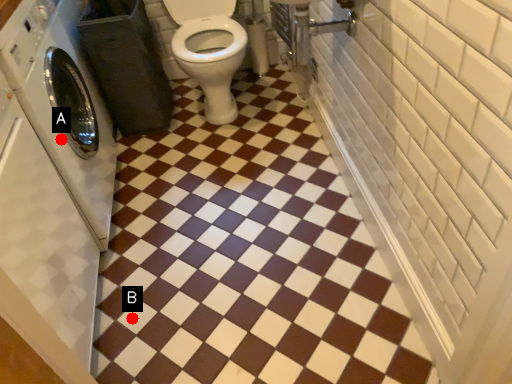
Question: Two points are circled on the image, labeled by A and B beside each circle. Which point is further to the camera?

Choices:
 (A) A is further
 (B) B is further

Answer: (B)